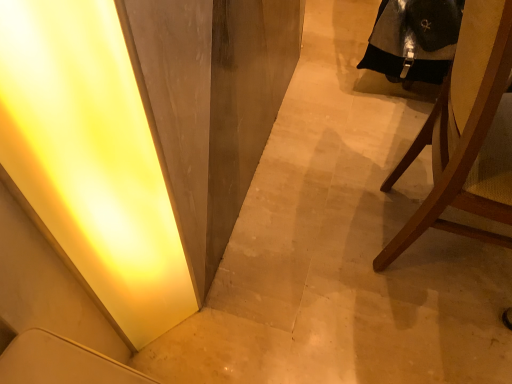
What do you see at coordinates (467, 134) in the screenshot? I see `brown wooden chair at right` at bounding box center [467, 134].

What do you see at coordinates (414, 39) in the screenshot?
I see `black leather robe at upper right` at bounding box center [414, 39].

What is the approximate height of matte yellow light at lower left?

The height of matte yellow light at lower left is 37.92 inches.

In order to click on brown wooden chair at right in this screenshot , I will do click(x=467, y=134).

From the image's perspective, is black leather robe at upper right above or below matte yellow light at lower left?

Clearly, from the image's perspective, black leather robe at upper right is above matte yellow light at lower left.

Is black leather robe at upper right to the right of matte yellow light at lower left from the viewer's perspective?

Indeed, black leather robe at upper right is positioned on the right side of matte yellow light at lower left.

Is the surface of black leather robe at upper right in direct contact with matte yellow light at lower left?

black leather robe at upper right and matte yellow light at lower left are not in contact.

Considering the relative sizes of black leather robe at upper right and matte yellow light at lower left in the image provided, is black leather robe at upper right thinner than matte yellow light at lower left?

In fact, black leather robe at upper right might be wider than matte yellow light at lower left.

From a real-world perspective, is brown wooden chair at right physically above black leather robe at upper right?

Indeed, from a real-world perspective, brown wooden chair at right stands above black leather robe at upper right.

Considering the relative positions of brown wooden chair at right and black leather robe at upper right in the image provided, is brown wooden chair at right to the left of black leather robe at upper right from the viewer's perspective?

No.

Is brown wooden chair at right touching black leather robe at upper right?

No, brown wooden chair at right is not beside black leather robe at upper right.

Considering the sizes of objects brown wooden chair at right and black leather robe at upper right in the image provided, who is thinner, brown wooden chair at right or black leather robe at upper right?

Thinner between the two is black leather robe at upper right.

Does black leather robe at upper right have a lesser width compared to brown wooden chair at right?

Indeed, black leather robe at upper right has a lesser width compared to brown wooden chair at right.

Is black leather robe at upper right taller than brown wooden chair at right?

No.

Can you see black leather robe at upper right touching brown wooden chair at right?

black leather robe at upper right and brown wooden chair at right are not in contact.

Is point (377, 63) farther from camera compared to point (418, 150)?

That is True.

Is brown wooden chair at right not near matte yellow light at lower left?

No.

Is brown wooden chair at right facing away from matte yellow light at lower left?

That's right, brown wooden chair at right is facing away from matte yellow light at lower left.

What's the angular difference between brown wooden chair at right and matte yellow light at lower left's facing directions?

They differ by 50.2 degrees in their facing directions.

From the image's perspective, who appears lower, brown wooden chair at right or matte yellow light at lower left?

matte yellow light at lower left is shown below in the image.

Is matte yellow light at lower left thinner than black leather robe at upper right?

Correct, the width of matte yellow light at lower left is less than that of black leather robe at upper right.

Considering the relative sizes of matte yellow light at lower left and black leather robe at upper right in the image provided, is matte yellow light at lower left bigger than black leather robe at upper right?

No.

Between point (40, 15) and point (360, 66), which one is positioned behind?

The point (360, 66) is more distant.

Who is bigger, matte yellow light at lower left or brown wooden chair at right?

brown wooden chair at right.

Considering their positions, is matte yellow light at lower left located in front of or behind brown wooden chair at right?

Clearly, matte yellow light at lower left is behind brown wooden chair at right.

Can you tell me how much matte yellow light at lower left and brown wooden chair at right differ in facing direction?

matte yellow light at lower left and brown wooden chair at right are facing 50.2 degrees away from each other.

Find the location of a particular element. robe behind the matte yellow light at lower left is located at coordinates (414, 39).

At what (x,y) coordinates should I click in order to perform the action: click on robe directly beneath the brown wooden chair at right (from a real-world perspective). Please return your answer as a coordinate pair (x, y). This screenshot has width=512, height=384. Looking at the image, I should click on (414, 39).

From the image, which object appears to be nearer to matte yellow light at lower left, black leather robe at upper right or brown wooden chair at right?

Among the two, brown wooden chair at right is located nearer to matte yellow light at lower left.

Considering their positions, is brown wooden chair at right positioned closer to matte yellow light at lower left than black leather robe at upper right?

Among the two, brown wooden chair at right is located nearer to matte yellow light at lower left.

Estimate the real-world distances between objects in this image. Which object is further from black leather robe at upper right, brown wooden chair at right or matte yellow light at lower left?

The object further to black leather robe at upper right is matte yellow light at lower left.

Looking at the image, which one is located closer to brown wooden chair at right, matte yellow light at lower left or black leather robe at upper right?

Based on the image, black leather robe at upper right appears to be nearer to brown wooden chair at right.

Looking at the image, which one is located further to brown wooden chair at right, black leather robe at upper right or matte yellow light at lower left?

matte yellow light at lower left is further to brown wooden chair at right.

Which object lies further to the anchor point black leather robe at upper right, matte yellow light at lower left or brown wooden chair at right?

Among the two, matte yellow light at lower left is located further to black leather robe at upper right.

Find the location of a particular element. The width and height of the screenshot is (512, 384). robe situated between matte yellow light at lower left and brown wooden chair at right from left to right is located at coordinates (414, 39).